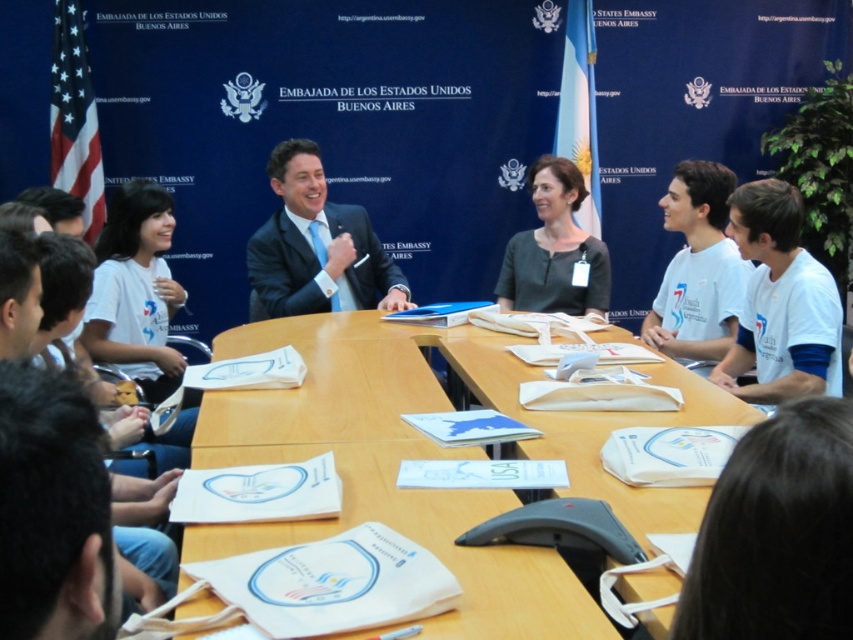
Question: Estimate the real-world distances between objects in this image. Which object is closer to the wooden table at center?

Choices:
 (A) dark gray shirt at center
 (B) shiny blue suit at center
 (C) white fabric bag at lower center

Answer: (C)

Question: Is wooden table at center further to the viewer compared to dark gray shirt at center?

Choices:
 (A) yes
 (B) no

Answer: (B)

Question: From the image, what is the correct spatial relationship of wooden table at center in relation to dark gray shirt at center?

Choices:
 (A) above
 (B) below

Answer: (B)

Question: Does white fabric bag at lower center have a larger size compared to dark gray shirt at center?

Choices:
 (A) no
 (B) yes

Answer: (A)

Question: Which of the following is the farthest from the observer?

Choices:
 (A) (91, 468)
 (B) (563, 259)

Answer: (B)

Question: Which of the following is the closest to the observer?

Choices:
 (A) shiny blue suit at center
 (B) dark gray shirt at center
 (C) white fabric bag at lower center

Answer: (C)